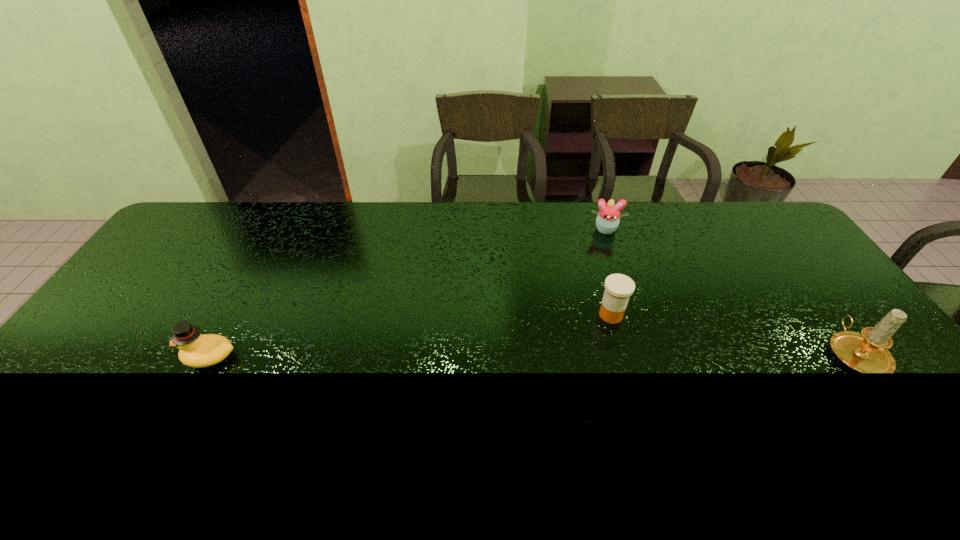
Find the location of a particular element. blank area located on the label of the second farthest object is located at coordinates (538, 372).

The height and width of the screenshot is (540, 960). In order to click on vacant space located on the label of the second farthest object in this screenshot , I will do `click(574, 343)`.

The width and height of the screenshot is (960, 540). In order to click on free location located on the face of the farthest object in this screenshot , I will do `click(611, 311)`.

Where is `vacant position located 0.260m on the face of the farthest object`? The image size is (960, 540). vacant position located 0.260m on the face of the farthest object is located at coordinates (609, 289).

I want to click on vacant space located 0.200m on the face of the farthest object, so click(608, 276).

Locate an element on the screen. Image resolution: width=960 pixels, height=540 pixels. object that is at the far edge is located at coordinates (607, 221).

Where is `object that is at the right edge`? object that is at the right edge is located at coordinates (867, 352).

Locate an element on the screen. free space at the far edge of the desktop is located at coordinates (678, 214).

In the image, there is a desktop. At what (x,y) coordinates should I click in order to perform the action: click on vacant space at the near edge. Please return your answer as a coordinate pair (x, y). Image resolution: width=960 pixels, height=540 pixels. Looking at the image, I should click on click(x=702, y=403).

Locate an element on the screen. This screenshot has height=540, width=960. vacant space at the left edge is located at coordinates (163, 276).